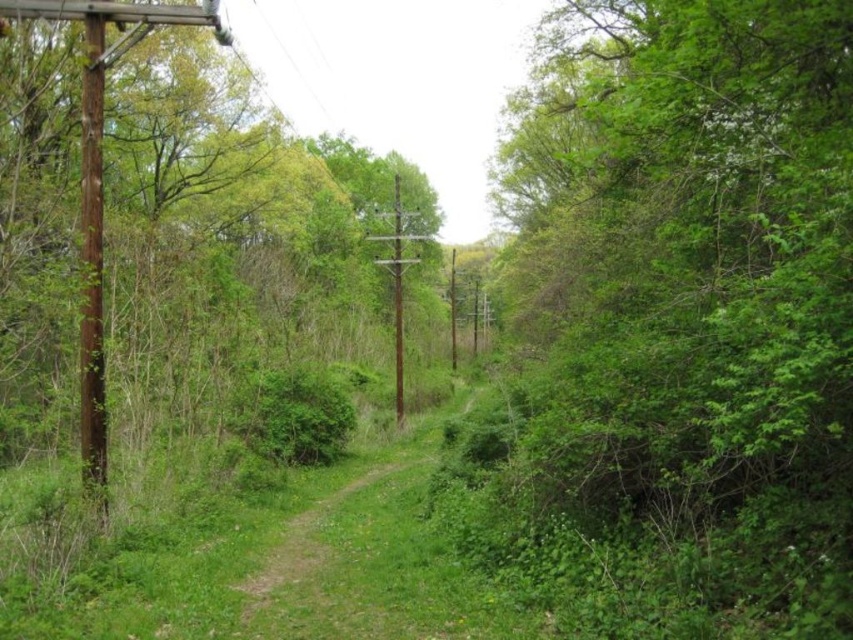
This screenshot has height=640, width=853. Describe the element at coordinates (692, 292) in the screenshot. I see `green leafy bush at right` at that location.

Can you confirm if green leafy bush at right is positioned to the right of green leafy tree at left?

Yes, green leafy bush at right is to the right of green leafy tree at left.

Image resolution: width=853 pixels, height=640 pixels. I want to click on green leafy bush at right, so click(692, 292).

Is green leafy bush at right taller than brown wooden pole at left?

Yes, green leafy bush at right is taller than brown wooden pole at left.

Does green leafy bush at right have a lesser height compared to brown wooden pole at left?

No.

This screenshot has width=853, height=640. I want to click on green leafy bush at right, so click(692, 292).

The image size is (853, 640). Find the location of `green leafy bush at right`. green leafy bush at right is located at coordinates (692, 292).

Between green grassy trail at center and brown wooden telegraph pole at center, which one appears on the left side from the viewer's perspective?

Positioned to the left is brown wooden telegraph pole at center.

Who is more distant from viewer, [314,518] or [393,256]?

Positioned behind is point [393,256].

The height and width of the screenshot is (640, 853). What are the coordinates of `green grassy trail at center` in the screenshot? It's located at (309, 536).